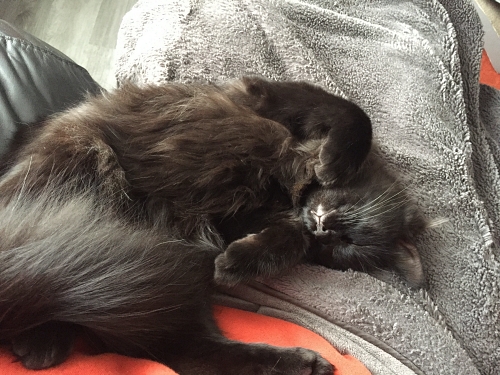
At what (x,y) coordinates should I click in order to perform the action: click on fold in blanket. Please return your answer as a coordinate pair (x, y). Looking at the image, I should click on (458, 334).